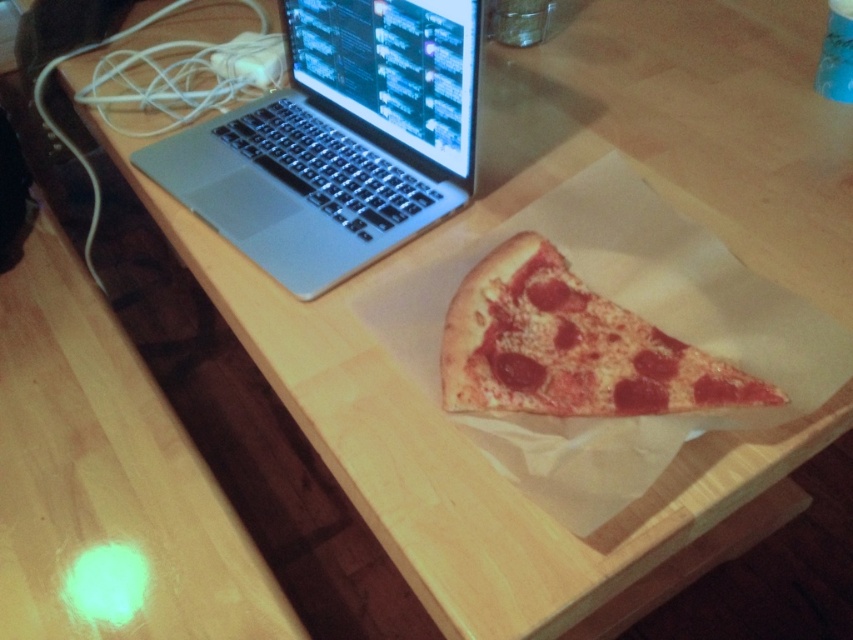
Question: From the image, what is the correct spatial relationship of silver metallic laptop at upper left in relation to cheesy pepperoni pizza at center?

Choices:
 (A) left
 (B) right

Answer: (A)

Question: Does silver metallic laptop at upper left have a smaller size compared to cheesy pepperoni pizza at center?

Choices:
 (A) no
 (B) yes

Answer: (A)

Question: Which point is closer to the camera?

Choices:
 (A) (529, 284)
 (B) (303, 184)

Answer: (A)

Question: Which object is farther from the camera taking this photo?

Choices:
 (A) cheesy pepperoni pizza at center
 (B) silver metallic laptop at upper left

Answer: (B)

Question: Is silver metallic laptop at upper left to the left of cheesy pepperoni pizza at center from the viewer's perspective?

Choices:
 (A) no
 (B) yes

Answer: (B)